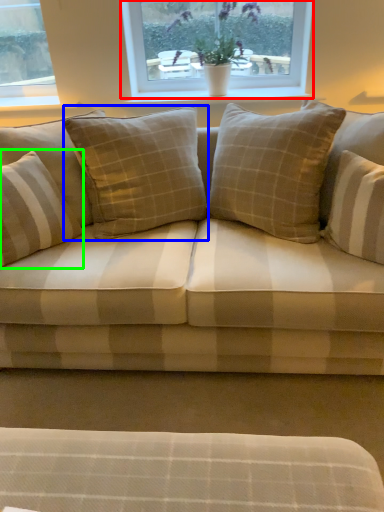
Question: Estimate the real-world distances between objects in this image. Which object is closer to window (highlighted by a red box), pillow (highlighted by a blue box) or pillow (highlighted by a green box)?

Choices:
 (A) pillow
 (B) pillow

Answer: (A)